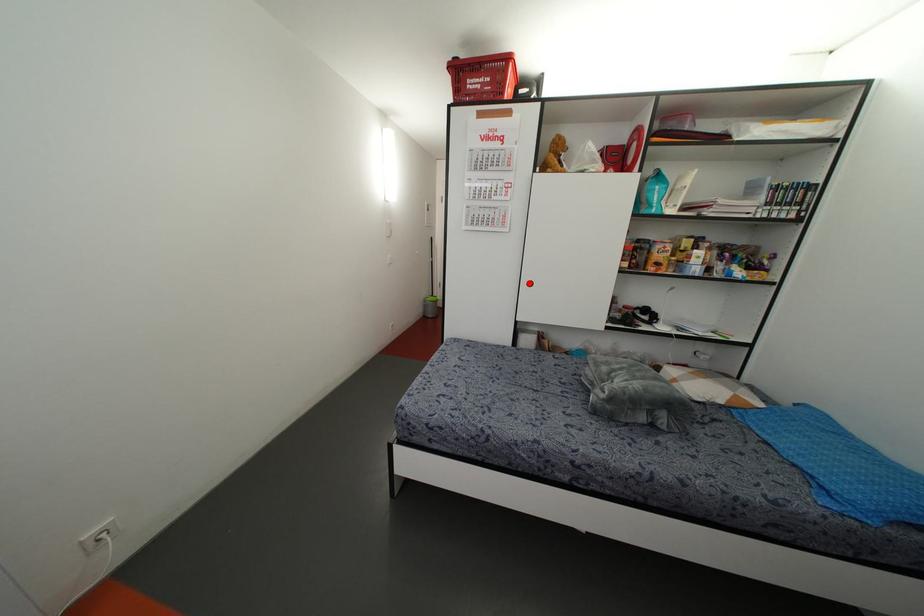
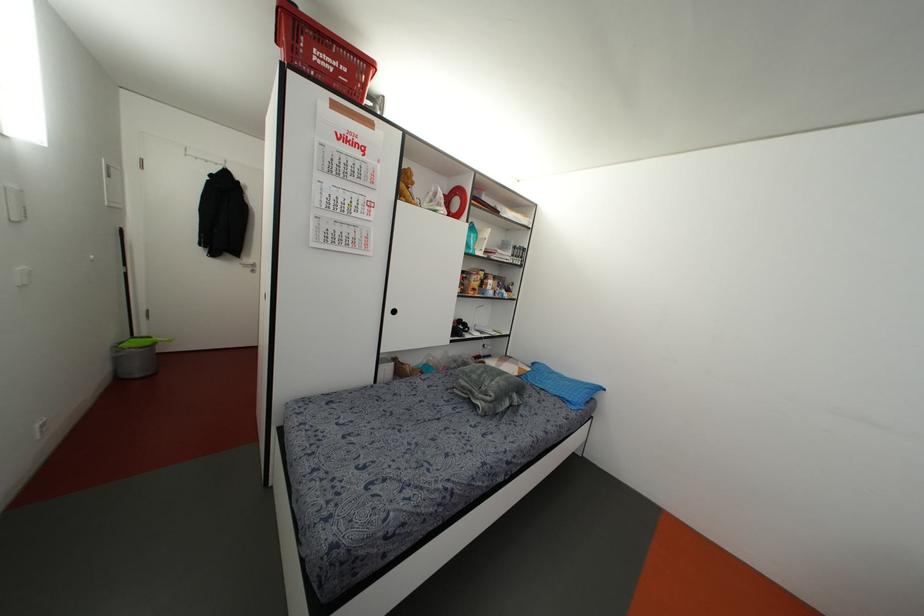
In the second image, find the point that corresponds to the highlighted location in the first image.

(394, 310)